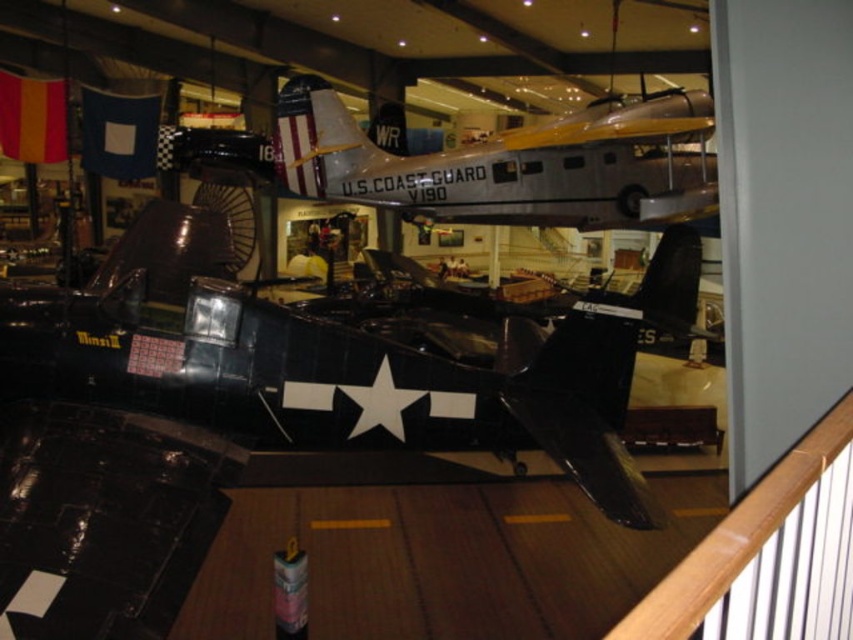
Question: Is shiny black airplane at center positioned in front of silver metallic airplane at center?

Choices:
 (A) yes
 (B) no

Answer: (B)

Question: Which point appears closest to the camera in this image?

Choices:
 (A) (601, 211)
 (B) (606, 344)

Answer: (B)

Question: Is shiny black airplane at center to the left of silver metallic airplane at center from the viewer's perspective?

Choices:
 (A) yes
 (B) no

Answer: (B)

Question: Which point is farther to the camera?

Choices:
 (A) (341, 141)
 (B) (424, 416)

Answer: (A)

Question: Which of the following is the farthest from the observer?

Choices:
 (A) (338, 298)
 (B) (461, 189)

Answer: (A)

Question: Does shiny black airplane at center appear on the left side of silver metallic airplane at center?

Choices:
 (A) yes
 (B) no

Answer: (B)